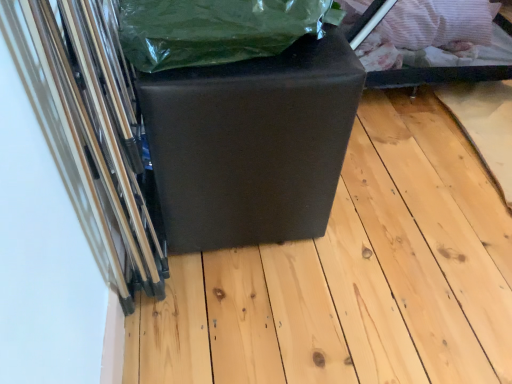
Question: Is matte black cube at center located within matte black cube at center?

Choices:
 (A) yes
 (B) no

Answer: (B)

Question: Is matte black cube at center directly adjacent to matte black cube at center?

Choices:
 (A) no
 (B) yes

Answer: (A)

Question: From the image's perspective, is matte black cube at center located above matte black cube at center?

Choices:
 (A) no
 (B) yes

Answer: (B)

Question: Is matte black cube at center at the left side of matte black cube at center?

Choices:
 (A) yes
 (B) no

Answer: (A)

Question: Is matte black cube at center further to camera compared to matte black cube at center?

Choices:
 (A) yes
 (B) no

Answer: (B)

Question: Does matte black cube at center have a larger size compared to matte black cube at center?

Choices:
 (A) yes
 (B) no

Answer: (A)

Question: Is green plastic bag at upper center outside matte black cube at center?

Choices:
 (A) no
 (B) yes

Answer: (B)

Question: Could you tell me if green plastic bag at upper center is facing matte black cube at center?

Choices:
 (A) yes
 (B) no

Answer: (B)

Question: Is green plastic bag at upper center oriented away from matte black cube at center?

Choices:
 (A) yes
 (B) no

Answer: (B)

Question: Is the surface of green plastic bag at upper center in direct contact with matte black cube at center?

Choices:
 (A) yes
 (B) no

Answer: (B)

Question: Does green plastic bag at upper center lie behind matte black cube at center?

Choices:
 (A) no
 (B) yes

Answer: (A)

Question: Considering the relative sizes of green plastic bag at upper center and matte black cube at center in the image provided, is green plastic bag at upper center smaller than matte black cube at center?

Choices:
 (A) yes
 (B) no

Answer: (A)

Question: Could you tell me if matte black cube at center is turned towards green plastic bag at upper center?

Choices:
 (A) no
 (B) yes

Answer: (A)